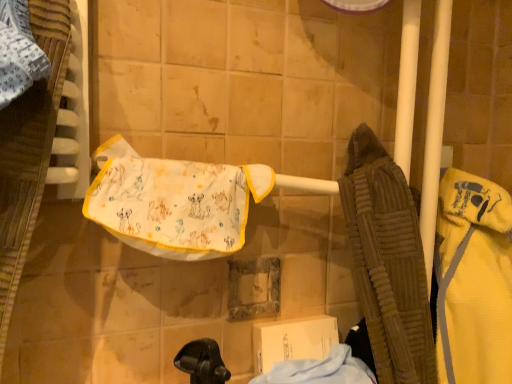
Question: Can you confirm if light blue cotton cloth at lower center is positioned to the right of yellow fleece bathrobe at right?

Choices:
 (A) yes
 (B) no

Answer: (B)

Question: From the image's perspective, is light blue cotton cloth at lower center above yellow fleece bathrobe at right?

Choices:
 (A) no
 (B) yes

Answer: (A)

Question: Does light blue cotton cloth at lower center appear on the left side of yellow fleece bathrobe at right?

Choices:
 (A) yes
 (B) no

Answer: (A)

Question: Is light blue cotton cloth at lower center not near yellow fleece bathrobe at right?

Choices:
 (A) yes
 (B) no

Answer: (B)

Question: Does light blue cotton cloth at lower center have a larger size compared to yellow fleece bathrobe at right?

Choices:
 (A) yes
 (B) no

Answer: (B)

Question: From a real-world perspective, does light blue cotton cloth at lower center stand above yellow fleece bathrobe at right?

Choices:
 (A) no
 (B) yes

Answer: (A)

Question: Considering the relative sizes of white fabric towel at center and yellow fleece bathrobe at right in the image provided, is white fabric towel at center wider than yellow fleece bathrobe at right?

Choices:
 (A) no
 (B) yes

Answer: (A)

Question: Does white fabric towel at center have a greater height compared to yellow fleece bathrobe at right?

Choices:
 (A) no
 (B) yes

Answer: (A)

Question: Is the depth of white fabric towel at center greater than that of yellow fleece bathrobe at right?

Choices:
 (A) yes
 (B) no

Answer: (B)

Question: From the image's perspective, would you say white fabric towel at center is positioned over yellow fleece bathrobe at right?

Choices:
 (A) yes
 (B) no

Answer: (A)

Question: Is white fabric towel at center closer to camera compared to yellow fleece bathrobe at right?

Choices:
 (A) yes
 (B) no

Answer: (A)

Question: From the image's perspective, is white fabric towel at center below yellow fleece bathrobe at right?

Choices:
 (A) no
 (B) yes

Answer: (A)

Question: From the image's perspective, is yellow fleece bathrobe at right over white fabric towel at center?

Choices:
 (A) yes
 (B) no

Answer: (B)